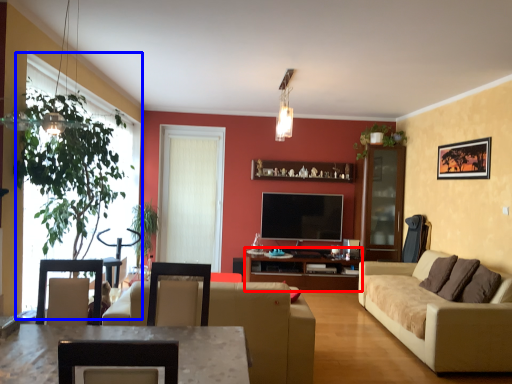
Question: Among these objects, which one is nearest to the camera, entertainment center (highlighted by a red box) or window (highlighted by a blue box)?

Choices:
 (A) entertainment center
 (B) window

Answer: (B)